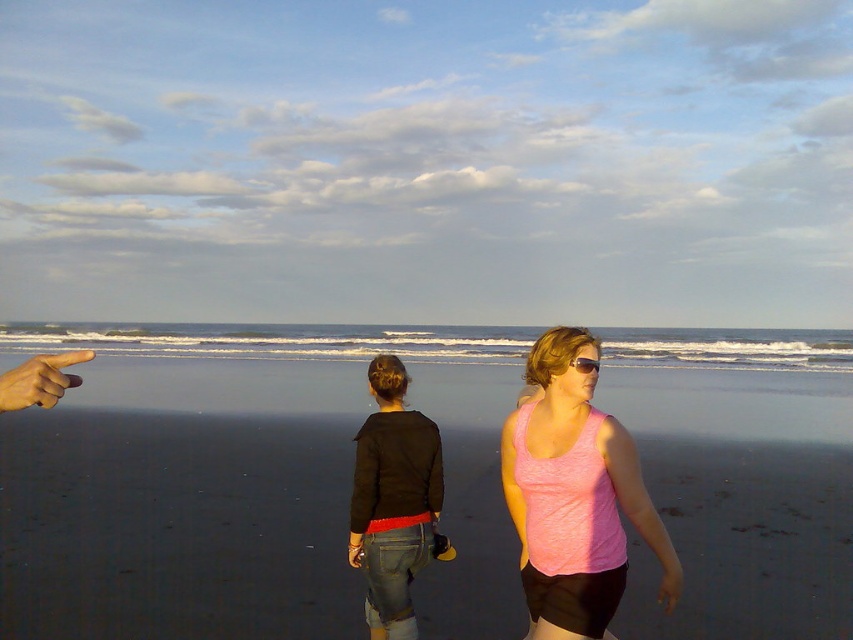
Can you confirm if pink fabric tank top at center is shorter than denim jeans at center?

No.

Who is positioned more to the left, pink fabric tank top at center or denim jeans at center?

Positioned to the left is denim jeans at center.

Locate an element on the screen. pink fabric tank top at center is located at coordinates pyautogui.click(x=573, y=497).

Does pink fabric tank top at center have a lesser width compared to skinny tan finger at upper left?

Yes.

Which is above, pink fabric tank top at center or skinny tan finger at upper left?

skinny tan finger at upper left is higher up.

Locate an element on the screen. This screenshot has width=853, height=640. pink fabric tank top at center is located at coordinates (573, 497).

Who is lower down, denim jeans at center or pink matte sunglasses at center?

Positioned lower is denim jeans at center.

Can you confirm if denim jeans at center is positioned to the left of pink matte sunglasses at center?

Yes, denim jeans at center is to the left of pink matte sunglasses at center.

Is point (389, 593) closer to camera compared to point (575, 362)?

No, it is behind (575, 362).

Locate an element on the screen. denim jeans at center is located at coordinates (393, 500).